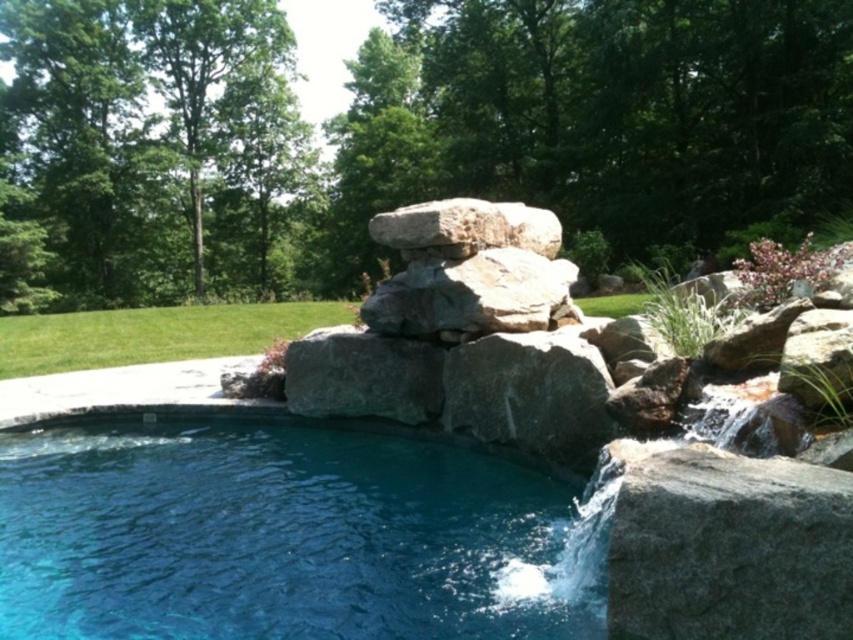
Question: Which of the following is the closest to the observer?

Choices:
 (A) blue smooth water at center
 (B) green grass at lower left
 (C) natural stone rock formation at center

Answer: (A)

Question: Which object is the farthest from the green leafy tree at upper left?

Choices:
 (A) green grass at lower left
 (B) green leafy tree at upper center

Answer: (A)

Question: Is green leafy tree at upper left above green grass at lower left?

Choices:
 (A) yes
 (B) no

Answer: (A)

Question: Which point is farther to the camera?

Choices:
 (A) (7, 330)
 (B) (849, 29)

Answer: (B)

Question: Is blue smooth water at center bigger than green leafy tree at upper left?

Choices:
 (A) yes
 (B) no

Answer: (B)

Question: Does natural stone rock formation at center appear on the right side of green grass at lower left?

Choices:
 (A) no
 (B) yes

Answer: (B)